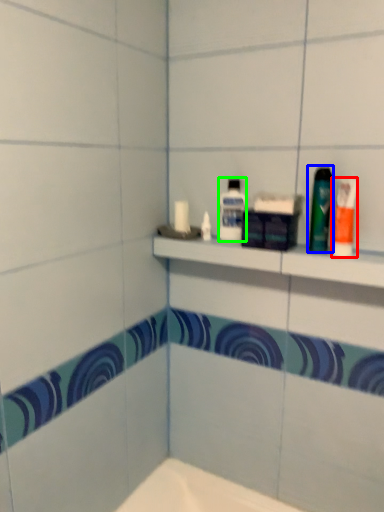
Question: Which object is positioned closest to toiletry (highlighted by a red box)? Select from mouthwash (highlighted by a blue box) and mouthwash (highlighted by a green box).

Choices:
 (A) mouthwash
 (B) mouthwash

Answer: (A)